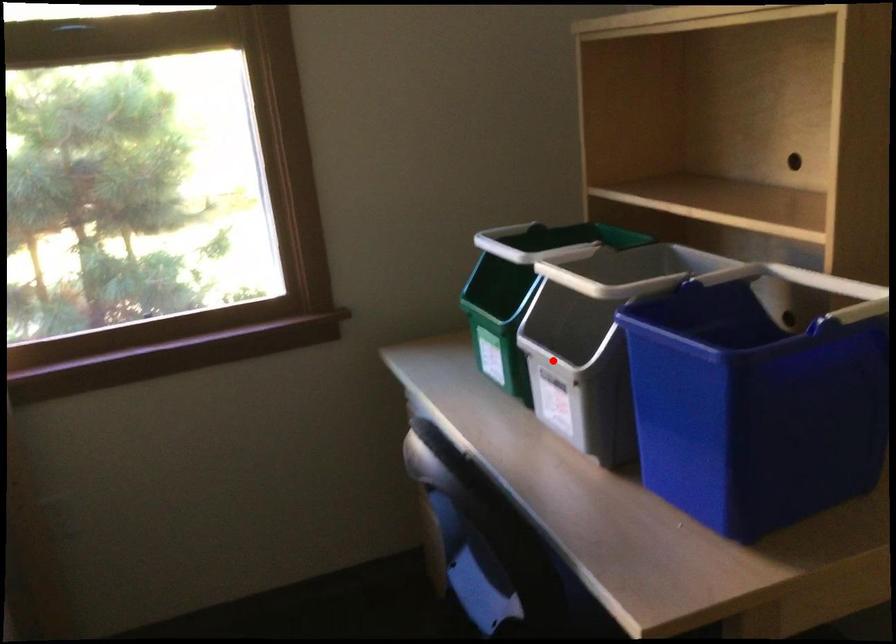
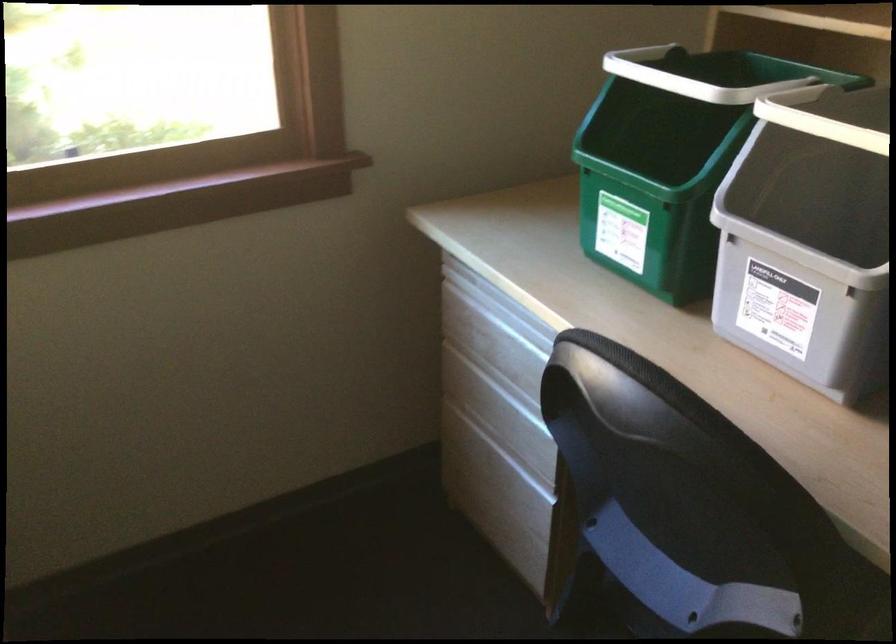
Where in the second image is the point corresponding to the highlighted location from the first image?

(797, 250)